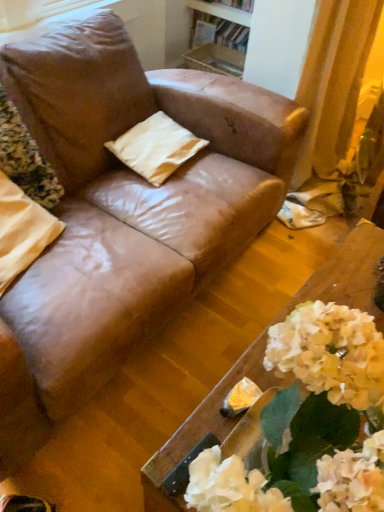
The image size is (384, 512). What do you see at coordinates (218, 37) in the screenshot?
I see `wooden bookshelf at upper center` at bounding box center [218, 37].

Where is `wooden bookshelf at upper center`? Image resolution: width=384 pixels, height=512 pixels. wooden bookshelf at upper center is located at coordinates (218, 37).

Is beige fabric pillow at center, the 2th pillow viewed from the front, oriented towards wooden bookshelf at upper center?

No.

Is beige fabric pillow at center, placed as the first pillow when sorted from back to front, completely or partially outside of wooden bookshelf at upper center?

Yes, beige fabric pillow at center, placed as the first pillow when sorted from back to front, is outside of wooden bookshelf at upper center.

How different are the orientations of beige fabric pillow at center, the second pillow when ordered from left to right, and wooden bookshelf at upper center in degrees?

The angular difference between beige fabric pillow at center, the second pillow when ordered from left to right, and wooden bookshelf at upper center is 91.5 degrees.

Between beige fabric pillow at center, placed as the first pillow when sorted from back to front, and wooden bookshelf at upper center, which one has larger width?

beige fabric pillow at center, placed as the first pillow when sorted from back to front, is wider.

Can we say wooden bookshelf at upper center lies outside matte brown pillow at upper left?

Yes, wooden bookshelf at upper center is outside of matte brown pillow at upper left.

How many degrees apart are the facing directions of wooden bookshelf at upper center and matte brown pillow at upper left?

The angular difference between wooden bookshelf at upper center and matte brown pillow at upper left is 89.9 degrees.

From a real-world perspective, is wooden bookshelf at upper center on matte brown pillow at upper left?

No, from a real-world perspective, wooden bookshelf at upper center is not over matte brown pillow at upper left

Who is shorter, wooden bookshelf at upper center or matte brown pillow at upper left?

With less height is wooden bookshelf at upper center.

Does point (60, 188) come in front of point (132, 127)?

Yes, point (60, 188) is in front of point (132, 127).

From the image's perspective, would you say matte brown pillow at upper left is positioned over beige fabric pillow at center, which is the first pillow from right to left?

No.

Find the location of `flower on the left of beige fabric pillow at center, the second pillow when ordered from left to right`. flower on the left of beige fabric pillow at center, the second pillow when ordered from left to right is located at coordinates (25, 158).

Is matte brown pillow at upper left next to beige fabric pillow at center, which is the first pillow from right to left?

They are not placed beside each other.

Does beige fabric pillow at left, positioned as the 1th pillow in front-to-back order, have a greater height compared to matte brown pillow at upper left?

Incorrect, the height of beige fabric pillow at left, positioned as the 1th pillow in front-to-back order, is not larger of that of matte brown pillow at upper left.

Is beige fabric pillow at left, positioned as the 1th pillow in front-to-back order, looking in the opposite direction of matte brown pillow at upper left?

Yes, beige fabric pillow at left, positioned as the 1th pillow in front-to-back order, is facing away from matte brown pillow at upper left.

Is there a large distance between beige fabric pillow at left, placed as the second pillow when sorted from back to front, and matte brown pillow at upper left?

No.

Which is more to the right, beige fabric pillow at center, which is the first pillow from right to left, or beige fabric pillow at left, marked as the 2th pillow in a right-to-left arrangement?

Positioned to the right is beige fabric pillow at center, which is the first pillow from right to left.

Is beige fabric pillow at center, placed as the first pillow when sorted from back to front, facing towards beige fabric pillow at left, marked as the 2th pillow in a right-to-left arrangement?

No, beige fabric pillow at center, placed as the first pillow when sorted from back to front, is not oriented towards beige fabric pillow at left, marked as the 2th pillow in a right-to-left arrangement.

Is the depth of beige fabric pillow at center, the 2th pillow viewed from the front, greater than that of beige fabric pillow at left, the first pillow in the left-to-right sequence?

Yes, it is behind beige fabric pillow at left, the first pillow in the left-to-right sequence.

In terms of height, does beige fabric pillow at center, placed as the first pillow when sorted from back to front, look taller or shorter compared to beige fabric pillow at left, marked as the 2th pillow in a right-to-left arrangement?

Considering their sizes, beige fabric pillow at center, placed as the first pillow when sorted from back to front, has less height than beige fabric pillow at left, marked as the 2th pillow in a right-to-left arrangement.

From the image's perspective, is matte brown pillow at upper left above or below beige fabric pillow at left, positioned as the 1th pillow in front-to-back order?

matte brown pillow at upper left is above beige fabric pillow at left, positioned as the 1th pillow in front-to-back order.

Which of these two, matte brown pillow at upper left or beige fabric pillow at left, marked as the 2th pillow in a right-to-left arrangement, is thinner?

beige fabric pillow at left, marked as the 2th pillow in a right-to-left arrangement.

Is matte brown pillow at upper left next to beige fabric pillow at left, marked as the 2th pillow in a right-to-left arrangement, and touching it?

No, matte brown pillow at upper left is not in contact with beige fabric pillow at left, marked as the 2th pillow in a right-to-left arrangement.

The width and height of the screenshot is (384, 512). Identify the location of pillow lying below the matte brown pillow at upper left (from the image's perspective). (22, 231).

Can you confirm if wooden bookshelf at upper center is positioned to the left of beige fabric pillow at center, placed as the first pillow when sorted from back to front?

Incorrect, wooden bookshelf at upper center is not on the left side of beige fabric pillow at center, placed as the first pillow when sorted from back to front.

Does wooden bookshelf at upper center have a smaller size compared to beige fabric pillow at center, the 2th pillow viewed from the front?

No, wooden bookshelf at upper center is not smaller than beige fabric pillow at center, the 2th pillow viewed from the front.

Looking at this image, from the image's perspective, is wooden bookshelf at upper center below beige fabric pillow at center, which is the first pillow from right to left?

Actually, wooden bookshelf at upper center appears above beige fabric pillow at center, which is the first pillow from right to left, in the image.

Which is less distant, (x=206, y=53) or (x=162, y=136)?

Point (x=206, y=53) is positioned farther from the camera compared to point (x=162, y=136).

Where is `bookshelf located above the beige fabric pillow at center, the second pillow when ordered from left to right (from the image's perspective)`? bookshelf located above the beige fabric pillow at center, the second pillow when ordered from left to right (from the image's perspective) is located at coordinates (218, 37).

Where is `flower on the left of wooden bookshelf at upper center`? The width and height of the screenshot is (384, 512). flower on the left of wooden bookshelf at upper center is located at coordinates point(25,158).

When comparing their distances from beige fabric pillow at center, the second pillow when ordered from left to right, does matte brown pillow at upper left or wooden table at lower right seem closer?

matte brown pillow at upper left lies closer to beige fabric pillow at center, the second pillow when ordered from left to right, than the other object.

From the image, which object appears to be farther from wooden bookshelf at upper center, matte brown pillow at upper left or beige fabric pillow at center, which is the first pillow from right to left?

The object further to wooden bookshelf at upper center is matte brown pillow at upper left.

Looking at the image, which one is located closer to matte brown pillow at upper left, wooden table at lower right or wooden bookshelf at upper center?

Based on the image, wooden table at lower right appears to be nearer to matte brown pillow at upper left.

Which object lies further to the anchor point beige fabric pillow at left, placed as the second pillow when sorted from back to front, beige fabric pillow at center, the 2th pillow viewed from the front, or wooden table at lower right?

wooden table at lower right is positioned further to the anchor beige fabric pillow at left, placed as the second pillow when sorted from back to front.

When comparing their distances from beige fabric pillow at center, placed as the first pillow when sorted from back to front, does wooden bookshelf at upper center or beige fabric pillow at left, marked as the 2th pillow in a right-to-left arrangement, seem further?

wooden bookshelf at upper center is positioned further to the anchor beige fabric pillow at center, placed as the first pillow when sorted from back to front.

Estimate the real-world distances between objects in this image. Which object is closer to wooden bookshelf at upper center, wooden table at lower right or beige fabric pillow at center, placed as the first pillow when sorted from back to front?

Among the two, beige fabric pillow at center, placed as the first pillow when sorted from back to front, is located nearer to wooden bookshelf at upper center.

Looking at the image, which one is located closer to beige fabric pillow at center, which is the first pillow from right to left, matte brown pillow at upper left or beige fabric pillow at left, marked as the 2th pillow in a right-to-left arrangement?

matte brown pillow at upper left.

When comparing their distances from matte brown pillow at upper left, does wooden table at lower right or beige fabric pillow at center, placed as the first pillow when sorted from back to front, seem further?

Based on the image, wooden table at lower right appears to be further to matte brown pillow at upper left.

Locate an element on the screen. Image resolution: width=384 pixels, height=512 pixels. pillow located between beige fabric pillow at left, placed as the second pillow when sorted from back to front, and wooden bookshelf at upper center in the depth direction is located at coordinates (156, 147).

Where is `pillow between wooden table at lower right and beige fabric pillow at center, placed as the first pillow when sorted from back to front, in the front-back direction`? pillow between wooden table at lower right and beige fabric pillow at center, placed as the first pillow when sorted from back to front, in the front-back direction is located at coordinates (22, 231).

This screenshot has width=384, height=512. What are the coordinates of `flower between wooden table at lower right and beige fabric pillow at center, which is the first pillow from right to left, from front to back` in the screenshot? It's located at (25, 158).

Locate an element on the screen. flower located between beige fabric pillow at left, positioned as the 1th pillow in front-to-back order, and beige fabric pillow at center, the 2th pillow viewed from the front, in the depth direction is located at coordinates (25, 158).